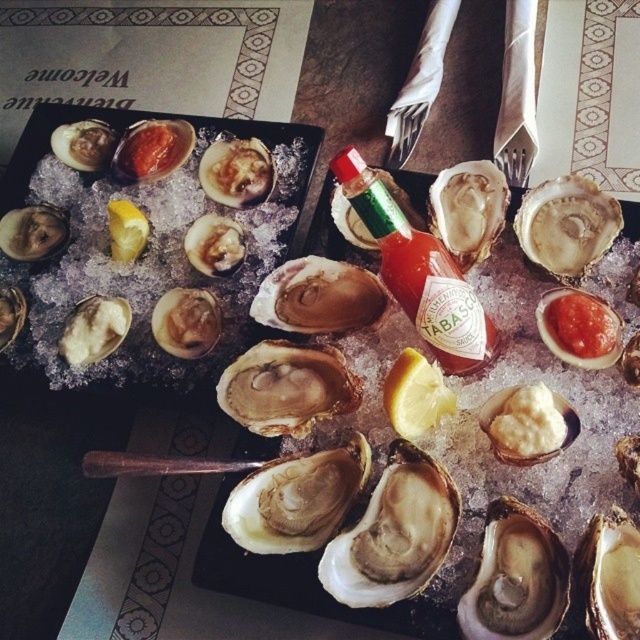
You are a customer at a seafood restaurant and see two points on the table where the serving trays are placed. The points are labeled as point 1 at coordinates (492, 435) and point 2 at coordinates (388, 401). Which point is closer to you as you look at the table?

Point 1 at coordinates (492, 435) is closer to you because it is further to the viewer than point 2 at coordinates (388, 401).

You are a chef preparing a dish and need to place a garnish exactly at the center of the white creamy mashed potato at center. Given that the coordinate system starts at the bottom left corner of the image, what are the coordinates where you should place the garnish?

The coordinates for the white creamy mashed potato at center are at point (x=525, y=424), so you should place the garnish at those coordinates.